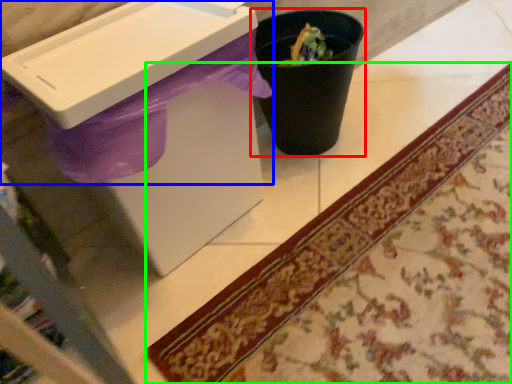
Question: Estimate the real-world distances between objects in this image. Which object is closer to waste container (highlighted by a red box), sink (highlighted by a blue box) or mat (highlighted by a green box)?

Choices:
 (A) sink
 (B) mat

Answer: (A)